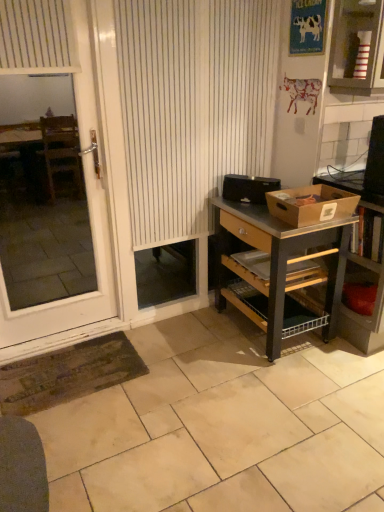
Question: Looking at the image, does striped cardboard box at upper right seem bigger or smaller compared to black plastic toaster at center, positioned as the second box in front-to-back order?

Choices:
 (A) small
 (B) big

Answer: (B)

Question: Relative to black plastic toaster at center, positioned as the second box in front-to-back order, is striped cardboard box at upper right in front or behind?

Choices:
 (A) behind
 (B) front

Answer: (B)

Question: Estimate the real-world distances between objects in this image. Which object is farther from the wooden shelf at right?

Choices:
 (A) white glossy screen door at left
 (B) beige tile at lower center
 (C) black plastic toaster at center, positioned as the second box in front-to-back order
 (D) brown cardboard box at right, which is counted as the 1th box, starting from the front
 (E) wooden desk at right

Answer: (A)

Question: Considering the real-world distances, which object is farthest from the wooden shelf at right?

Choices:
 (A) striped cardboard box at upper right
 (B) white glossy screen door at left
 (C) black plastic toaster at center, the first box positioned from the back
 (D) brown cardboard box at right, placed as the 2th box when sorted from back to front
 (E) wooden desk at right

Answer: (B)